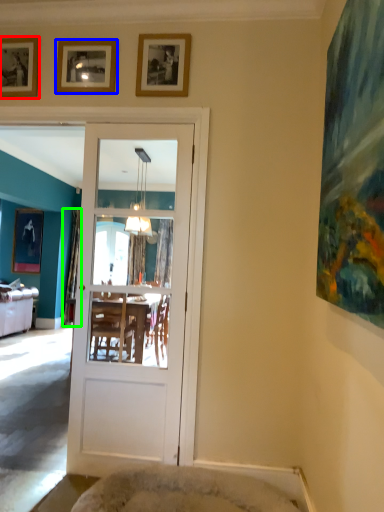
Question: Estimate the real-world distances between objects in this image. Which object is closer to picture frame (highlighted by a red box), picture frame (highlighted by a blue box) or curtain (highlighted by a green box)?

Choices:
 (A) picture frame
 (B) curtain

Answer: (A)